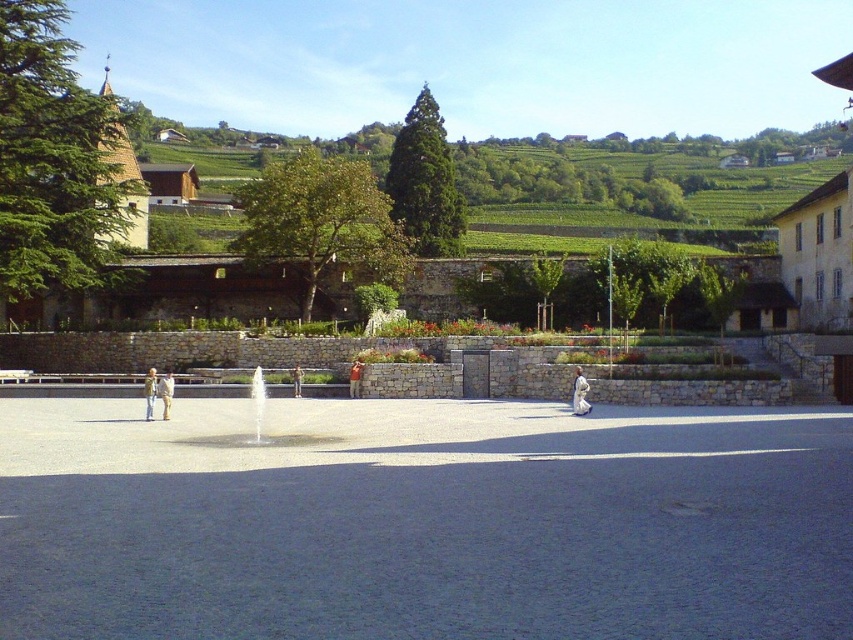
You are standing in the courtyard looking towards the garden wall. There are two points marked on the image at coordinates point (152, 385) and point (293, 371). Which point is closer to you?

Point (152, 385) is closer to the camera than point (293, 371), so the point at (152, 385) is closer to you.

You are standing in the courtyard of a European building and see a light brown leather jacket at left. Where exactly is the light brown leather jacket located in the image?

The light brown leather jacket at left is located at the coordinates point (x=149, y=392).